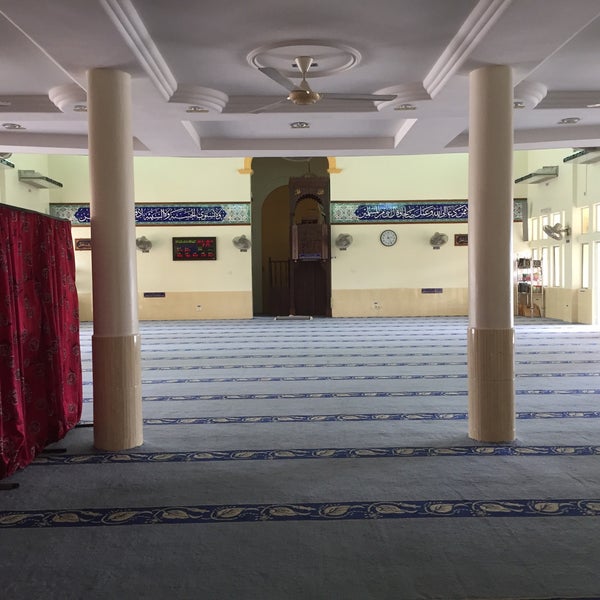
The image size is (600, 600). Find the location of `archway`. archway is located at coordinates (301, 267).